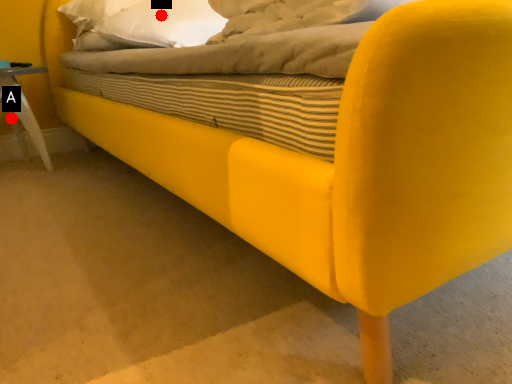
Question: Two points are circled on the image, labeled by A and B beside each circle. Which point is farther to the camera?

Choices:
 (A) A is further
 (B) B is further

Answer: (A)